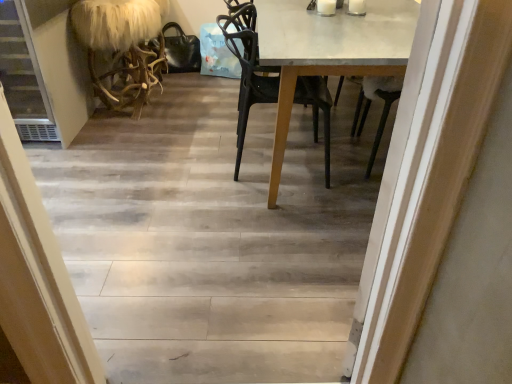
Question: From the image's perspective, is white glossy table at center located above or below black matte chair at center?

Choices:
 (A) above
 (B) below

Answer: (A)

Question: From a real-world perspective, relative to black matte chair at center, is white glossy table at center vertically above or below?

Choices:
 (A) above
 (B) below

Answer: (B)

Question: Considering the real-world distances, which object is farthest from the black matte chair at center?

Choices:
 (A) fuzzy white fur at left
 (B) white glossy table at center
 (C) wooden floor at center

Answer: (A)

Question: Estimate the real-world distances between objects in this image. Which object is farther from the fuzzy white fur at left?

Choices:
 (A) white glossy table at center
 (B) wooden floor at center
 (C) black matte chair at center

Answer: (A)